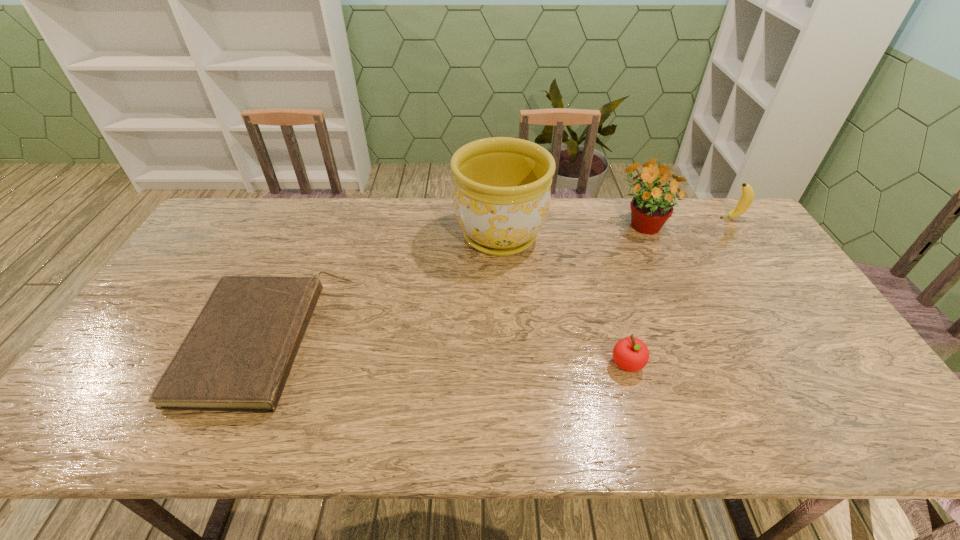
Identify the location of vacant area at the near edge of the desktop. (658, 426).

Image resolution: width=960 pixels, height=540 pixels. In order to click on vacant space at the left edge of the desktop in this screenshot , I will do `click(198, 284)`.

Where is `vacant space at the right edge`? vacant space at the right edge is located at coordinates (767, 280).

In the image, there is a desktop. Where is `vacant area at the far left corner`? vacant area at the far left corner is located at coordinates (243, 199).

Image resolution: width=960 pixels, height=540 pixels. I want to click on free spot at the far right corner of the desktop, so click(x=699, y=217).

In the image, there is a desktop. Where is `vacant space at the near right corner`? This screenshot has width=960, height=540. vacant space at the near right corner is located at coordinates (891, 428).

Where is `vacant space in between the second shortest object and the right flowerpot`? This screenshot has height=540, width=960. vacant space in between the second shortest object and the right flowerpot is located at coordinates tap(635, 294).

Where is `free spot between the third object from right to left and the left flowerpot`? free spot between the third object from right to left and the left flowerpot is located at coordinates (564, 300).

Locate an element on the screen. Image resolution: width=960 pixels, height=540 pixels. free space between the banana and the left flowerpot is located at coordinates click(615, 227).

The width and height of the screenshot is (960, 540). I want to click on free space between the apple and the second object from left to right, so click(564, 300).